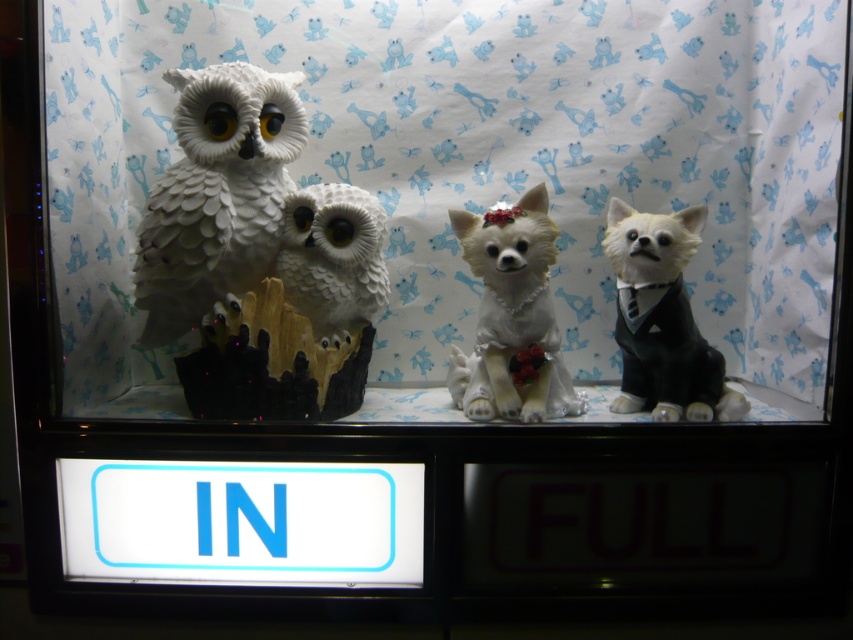
You are standing in front of the display case and want to touch the two points inside the case. Which point, point (209, 209) or point (364, 248), is closer to your hand?

Point (209, 209) is closer to the viewer than point (364, 248), so it is closer to your hand.

You are a customer in a gift shop looking at the display case. You want to buy the white glossy owl at left and the white porcelain chihuahua at center. The shop has a rule that you can only buy items that are positioned to the left of another item. Can you buy both items?

The white glossy owl at left is positioned on the left side of the white porcelain chihuahua at center, so you can buy both items because the owl is to the left of the chihuahua, satisfying the shop rule.